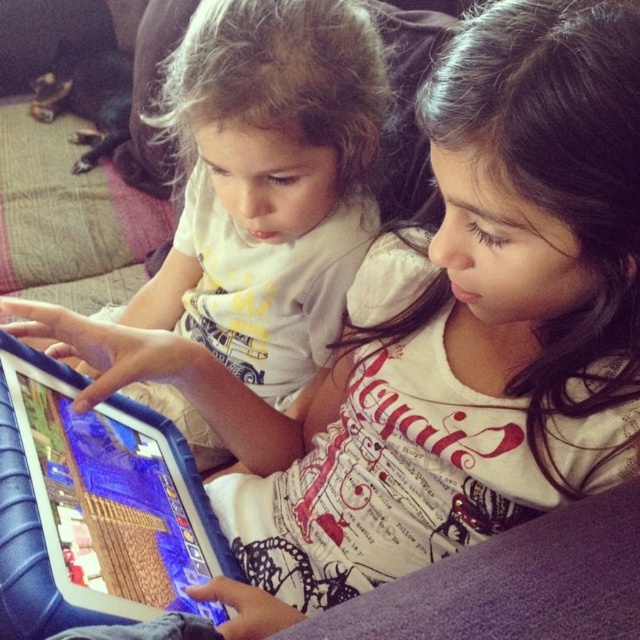
You are a photographer standing at the camera position. You want to take a photo of the point at coordinate point (x=300, y=180). The camera has a minimum focus distance of 70 centimeters. Will the camera be able to focus on that point?

The point (x=300, y=180) is 69.78 centimeters away from the camera. Since the minimum focus distance is 70 centimeters, the camera cannot focus on the point because it is slightly closer than the required distance.

You are a photographer trying to focus your camera on the matte white shirt at center. Your camera has a focus grid that shows coordinates. Where should you adjust the focus to in terms of coordinates?

The matte white shirt at center is located at coordinates point [268,182], so adjust the focus to that coordinate point.

You are a photographer trying to capture a clear shot of both the matte white shirt at center and the blue rubberized tablet at center. Since the camera has a limited focus range, you need to know which object is bigger to adjust the focus. Which one is larger?

The matte white shirt at center has a larger size compared to the blue rubberized tablet at center, so you should focus on the matte white shirt at center as it is bigger.